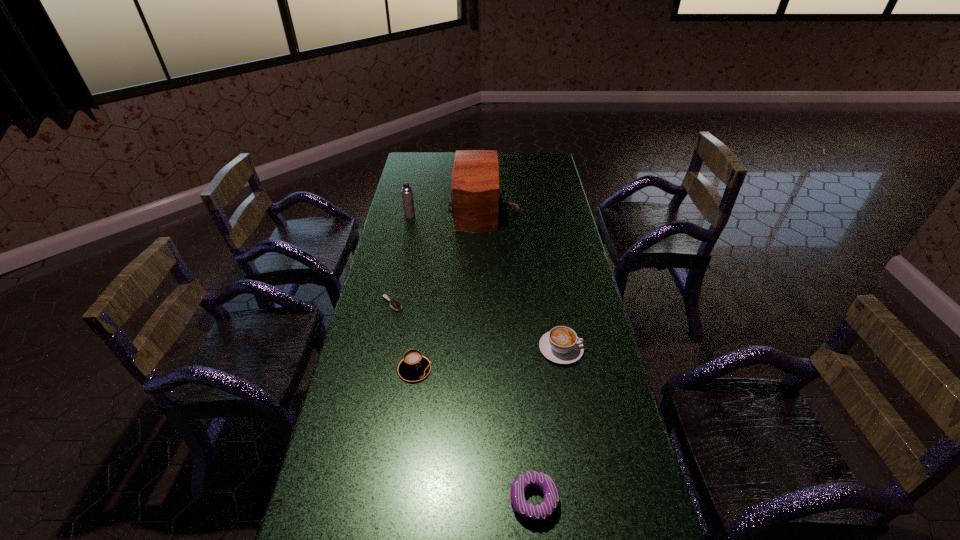
In order to click on the tallest object in this screenshot , I will do `click(475, 203)`.

Where is `the fifth shortest object`? the fifth shortest object is located at coordinates (407, 195).

Where is `the left cappuccino`? The image size is (960, 540). the left cappuccino is located at coordinates click(x=414, y=367).

Locate an element on the screen. The width and height of the screenshot is (960, 540). the right cappuccino is located at coordinates (561, 345).

You are a GUI agent. You are given a task and a screenshot of the screen. Output one action in this format:
    pyautogui.click(x=<x>, y=<y>)
    Task: Click on the fifth tallest object
    This screenshot has width=960, height=540.
    Given the screenshot: What is the action you would take?
    pyautogui.click(x=533, y=513)

Image resolution: width=960 pixels, height=540 pixels. I want to click on the nearest object, so click(533, 513).

This screenshot has width=960, height=540. In order to click on the third farthest object in this screenshot , I will do `click(394, 304)`.

Find the location of a particular element. This screenshot has height=540, width=960. the shortest object is located at coordinates (394, 304).

What are the coordinates of `vacant space located on the front-facing side of the radio receiver` in the screenshot? It's located at (x=414, y=208).

What are the coordinates of `vacant region located 0.190m on the front-facing side of the radio receiver` in the screenshot? It's located at (409, 208).